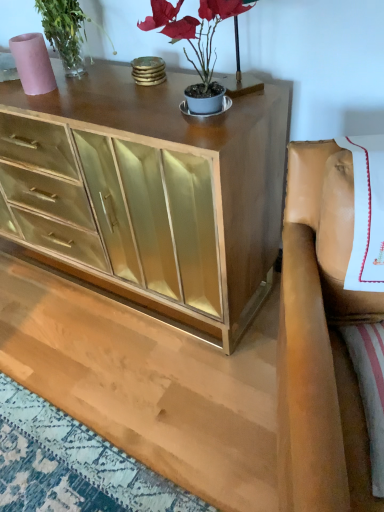
The height and width of the screenshot is (512, 384). Describe the element at coordinates (33, 63) in the screenshot. I see `matte pink vase at upper left` at that location.

Identify the location of matte gold plant at upper center. (197, 44).

At what (x,y) coordinates should I click in order to perform the action: click on matte pink vase at upper left. Please return your answer as a coordinate pair (x, y). Looking at the image, I should click on (33, 63).

Is matte pink vase at upper left not within matte gold plant at upper center?

matte pink vase at upper left is positioned outside matte gold plant at upper center.

Does matte pink vase at upper left appear on the right side of matte gold plant at upper center?

No.

This screenshot has height=512, width=384. Find the location of `houseplant that is below the matte pink vase at upper left (from the image's perspective)`. houseplant that is below the matte pink vase at upper left (from the image's perspective) is located at coordinates (197, 44).

From the image's perspective, is gold mirrored cabinet at center over matte pink vase at upper left?

No, from the image's perspective, gold mirrored cabinet at center is not above matte pink vase at upper left.

Can matte pink vase at upper left be found inside gold mirrored cabinet at center?

No.

Which is behind, gold mirrored cabinet at center or matte pink vase at upper left?

Positioned behind is matte pink vase at upper left.

Looking at this image, does gold mirrored cabinet at center have a greater height compared to matte pink vase at upper left?

Yes, gold mirrored cabinet at center is taller than matte pink vase at upper left.

Considering the positions of objects matte gold plant at upper center and matte pink vase at upper left in the image provided, who is more to the right, matte gold plant at upper center or matte pink vase at upper left?

From the viewer's perspective, matte gold plant at upper center appears more on the right side.

Is the surface of matte gold plant at upper center in direct contact with matte pink vase at upper left?

They are not placed beside each other.

Considering the positions of point (178, 22) and point (53, 84), is point (178, 22) closer or farther from the camera than point (53, 84)?

Point (178, 22).

Does matte pink vase at upper left have a lesser height compared to gold mirrored cabinet at center?

Indeed, matte pink vase at upper left has a lesser height compared to gold mirrored cabinet at center.

You are a GUI agent. You are given a task and a screenshot of the screen. Output one action in this format:
    pyautogui.click(x=<x>, y=<y>)
    Task: Click on the chest of drawers that is in front of the matte pink vase at upper left
    This screenshot has width=384, height=512.
    Given the screenshot: What is the action you would take?
    pyautogui.click(x=148, y=192)

Does matte pink vase at upper left have a lesser width compared to gold mirrored cabinet at center?

Yes, matte pink vase at upper left is thinner than gold mirrored cabinet at center.

Does matte pink vase at upper left have a larger size compared to gold mirrored cabinet at center?

No.

Is gold mirrored cabinet at center positioned with its back to matte gold plant at upper center?

No, matte gold plant at upper center is not at the back of gold mirrored cabinet at center.

Which of these two, gold mirrored cabinet at center or matte gold plant at upper center, stands taller?

gold mirrored cabinet at center.

Is gold mirrored cabinet at center in contact with matte gold plant at upper center?

No, gold mirrored cabinet at center is not making contact with matte gold plant at upper center.

The width and height of the screenshot is (384, 512). What are the coordinates of `vase above the leather at right (from the image's perspective)` in the screenshot? It's located at (33, 63).

Considering the sizes of leather at right and matte pink vase at upper left in the image, is leather at right bigger or smaller than matte pink vase at upper left?

Clearly, leather at right is larger in size than matte pink vase at upper left.

Which of these two, leather at right or matte pink vase at upper left, stands shorter?

matte pink vase at upper left is shorter.

Is matte gold plant at upper center positioned before gold mirrored cabinet at center?

Yes, matte gold plant at upper center is closer to the camera.

In terms of width, does matte gold plant at upper center look wider or thinner when compared to gold mirrored cabinet at center?

matte gold plant at upper center is thinner than gold mirrored cabinet at center.

How distant is matte gold plant at upper center from gold mirrored cabinet at center?

A distance of 15.50 inches exists between matte gold plant at upper center and gold mirrored cabinet at center.

Considering the sizes of objects matte gold plant at upper center and gold mirrored cabinet at center in the image provided, who is bigger, matte gold plant at upper center or gold mirrored cabinet at center?

gold mirrored cabinet at center is bigger.

The height and width of the screenshot is (512, 384). What are the coordinates of `vase below the matte gold plant at upper center (from a real-world perspective)` in the screenshot? It's located at (33, 63).

At what (x,y) coordinates should I click in order to perform the action: click on vase above the gold mirrored cabinet at center (from the image's perspective). Please return your answer as a coordinate pair (x, y). Image resolution: width=384 pixels, height=512 pixels. Looking at the image, I should click on (33, 63).

When comparing their distances from gold mirrored cabinet at center, does leather at right or matte pink vase at upper left seem closer?

matte pink vase at upper left is positioned closer to the anchor gold mirrored cabinet at center.

Looking at the image, which one is located further to matte gold plant at upper center, gold mirrored cabinet at center or matte pink vase at upper left?

The object further to matte gold plant at upper center is matte pink vase at upper left.

When comparing their distances from matte gold plant at upper center, does matte pink vase at upper left or gold mirrored cabinet at center seem further?

The object further to matte gold plant at upper center is matte pink vase at upper left.

Looking at this image, based on their spatial positions, is gold mirrored cabinet at center or matte gold plant at upper center further from leather at right?

gold mirrored cabinet at center is further to leather at right.

Estimate the real-world distances between objects in this image. Which object is further from gold mirrored cabinet at center, matte pink vase at upper left or leather at right?

Among the two, leather at right is located further to gold mirrored cabinet at center.

Which object lies further to the anchor point leather at right, matte pink vase at upper left or gold mirrored cabinet at center?

matte pink vase at upper left is further to leather at right.

Estimate the real-world distances between objects in this image. Which object is closer to gold mirrored cabinet at center, matte gold plant at upper center or leather at right?

matte gold plant at upper center lies closer to gold mirrored cabinet at center than the other object.

Considering their positions, is matte gold plant at upper center positioned further to leather at right than matte pink vase at upper left?

matte pink vase at upper left is positioned further to the anchor leather at right.

Find the location of a particular element. This screenshot has width=384, height=512. houseplant between gold mirrored cabinet at center and leather at right from left to right is located at coordinates (197, 44).

Identify the location of houseplant that lies between matte pink vase at upper left and leather at right from top to bottom. The width and height of the screenshot is (384, 512). (197, 44).

This screenshot has width=384, height=512. I want to click on chest of drawers between matte pink vase at upper left and matte gold plant at upper center in the horizontal direction, so click(148, 192).

This screenshot has height=512, width=384. In order to click on the chest of drawers located between matte pink vase at upper left and leather at right in the left-right direction in this screenshot , I will do (x=148, y=192).